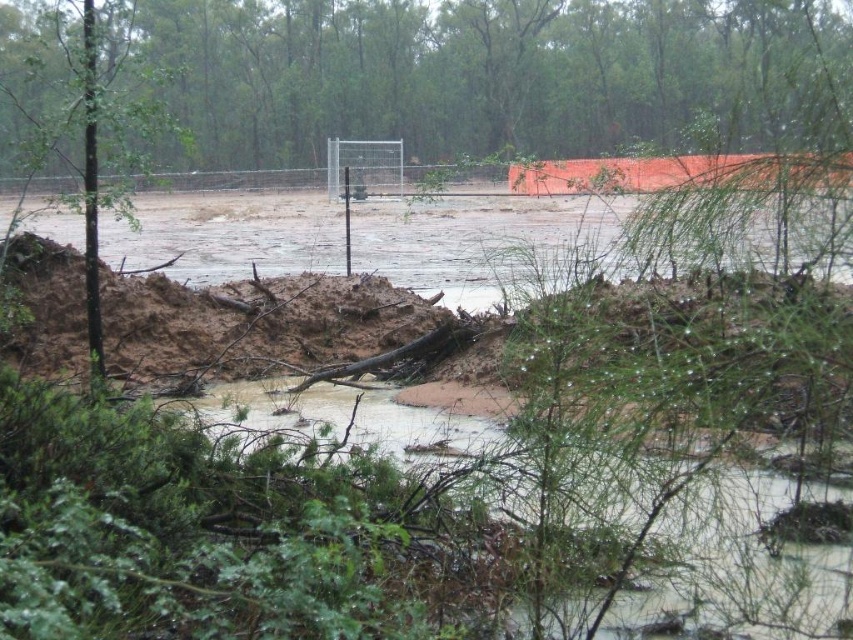
Which is more to the left, green matte fence at upper center or brown muddy water at center?

green matte fence at upper center

Can you confirm if green matte fence at upper center is taller than brown muddy water at center?

Indeed, green matte fence at upper center has a greater height compared to brown muddy water at center.

Does point (584, 74) come closer to viewer compared to point (711, 563)?

No, it is behind (711, 563).

In order to click on green matte fence at upper center in this screenshot , I will do `click(490, 74)`.